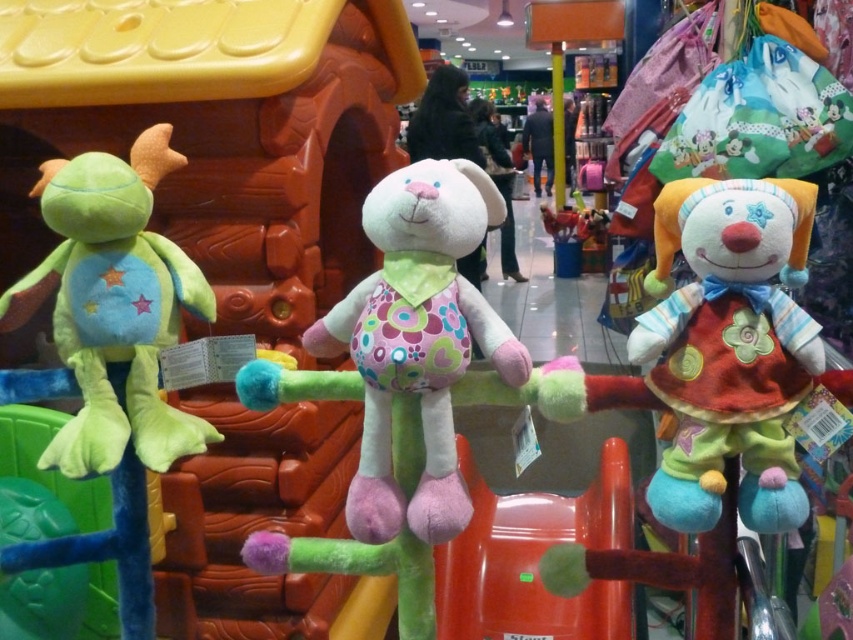
Question: Is fluffy multicolored clown doll at right to the left of green plush turtle at left from the viewer's perspective?

Choices:
 (A) no
 (B) yes

Answer: (A)

Question: Which object is closer to the camera taking this photo?

Choices:
 (A) green plush turtle at left
 (B) fluffy white plush rabbit at center
 (C) fluffy multicolored clown doll at right

Answer: (C)

Question: Can you confirm if fluffy white plush rabbit at center is smaller than green plush turtle at left?

Choices:
 (A) yes
 (B) no

Answer: (B)

Question: Which object is the closest to the fluffy white plush rabbit at center?

Choices:
 (A) fluffy multicolored clown doll at right
 (B) green plush turtle at left

Answer: (A)

Question: Which object is positioned closest to the fluffy multicolored clown doll at right?

Choices:
 (A) green plush turtle at left
 (B) fluffy white plush rabbit at center

Answer: (B)

Question: Does fluffy white plush rabbit at center appear on the left side of green plush turtle at left?

Choices:
 (A) yes
 (B) no

Answer: (B)